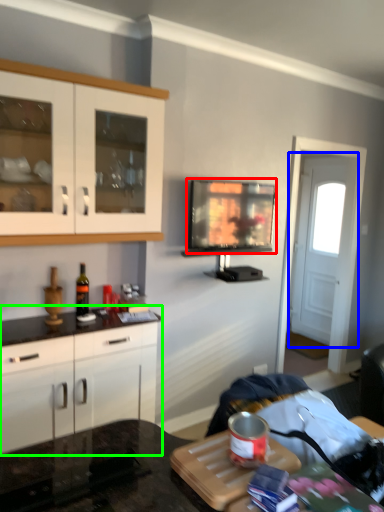
Question: Based on their relative distances, which object is nearer to television (highlighted by a red box)? Choose from door (highlighted by a blue box) and cabinetry (highlighted by a green box).

Choices:
 (A) door
 (B) cabinetry

Answer: (B)